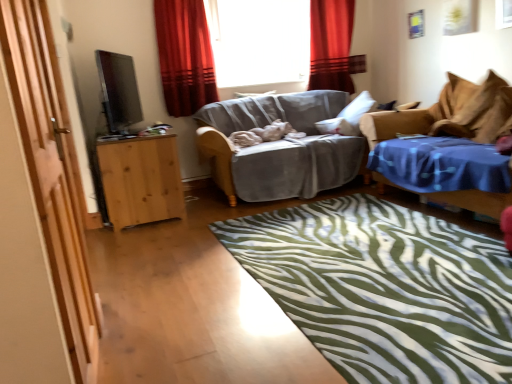
The width and height of the screenshot is (512, 384). What are the coordinates of `vacant space to the right of wooden door at left` in the screenshot? It's located at (193, 355).